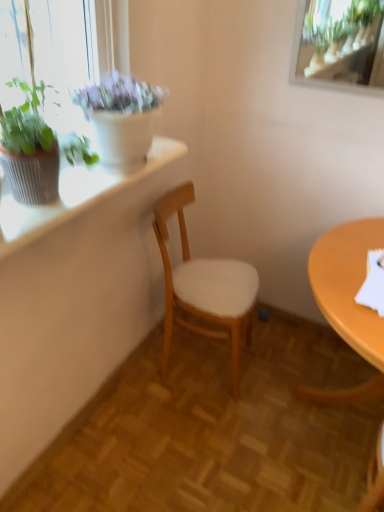
Identify the location of free point in front of white woven wood chair at center. The image size is (384, 512). (194, 424).